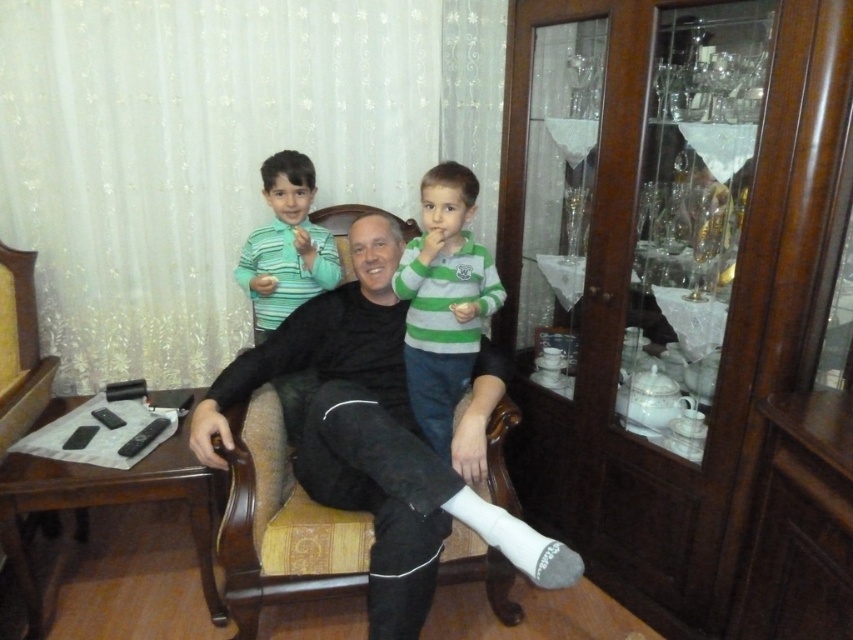
Question: Is black matte shirt at center above green striped shirt at upper center?

Choices:
 (A) no
 (B) yes

Answer: (A)

Question: Among these points, which one is farthest from the camera?

Choices:
 (A) pos(424,266)
 (B) pos(421,484)

Answer: (A)

Question: Considering the relative positions of black matte shirt at center and green striped shirt at upper center in the image provided, where is black matte shirt at center located with respect to green striped shirt at upper center?

Choices:
 (A) below
 (B) above

Answer: (A)

Question: Does black matte shirt at center have a greater width compared to green striped shirt at upper center?

Choices:
 (A) yes
 (B) no

Answer: (A)

Question: Which object appears closest to the camera in this image?

Choices:
 (A) green striped sweater at upper center
 (B) black matte shirt at center
 (C) green striped shirt at upper center

Answer: (B)

Question: Estimate the real-world distances between objects in this image. Which object is farther from the green striped shirt at upper center?

Choices:
 (A) green striped sweater at upper center
 (B) black matte shirt at center

Answer: (A)